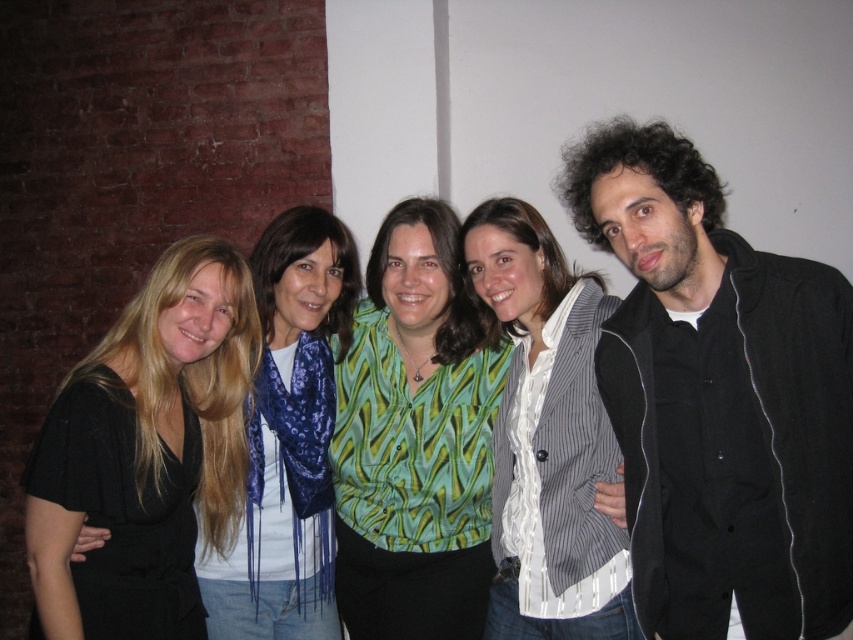
Question: Which object is farther from the camera taking this photo?

Choices:
 (A) striped fabric shirt at center
 (B) black matte dress at left
 (C) black matte jacket at center

Answer: (A)

Question: Can you confirm if black matte jacket at center is positioned below black matte dress at left?

Choices:
 (A) yes
 (B) no

Answer: (B)

Question: Estimate the real-world distances between objects in this image. Which object is closer to the black matte dress at left?

Choices:
 (A) striped fabric shirt at center
 (B) green printed blouse at center

Answer: (B)

Question: Can you confirm if black matte jacket at center is positioned to the right of green printed blouse at center?

Choices:
 (A) no
 (B) yes

Answer: (B)

Question: Considering the real-world distances, which object is farthest from the black matte jacket at center?

Choices:
 (A) green printed blouse at center
 (B) striped fabric shirt at center
 (C) black matte dress at left

Answer: (C)

Question: Can you confirm if black matte dress at left is smaller than striped fabric shirt at center?

Choices:
 (A) yes
 (B) no

Answer: (B)